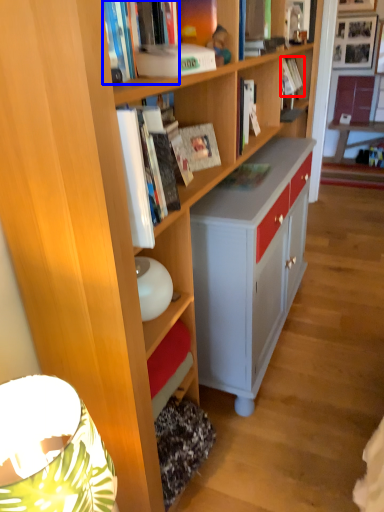
Question: Which of the following is the farthest to the observer, book (highlighted by a red box) or book (highlighted by a blue box)?

Choices:
 (A) book
 (B) book

Answer: (A)